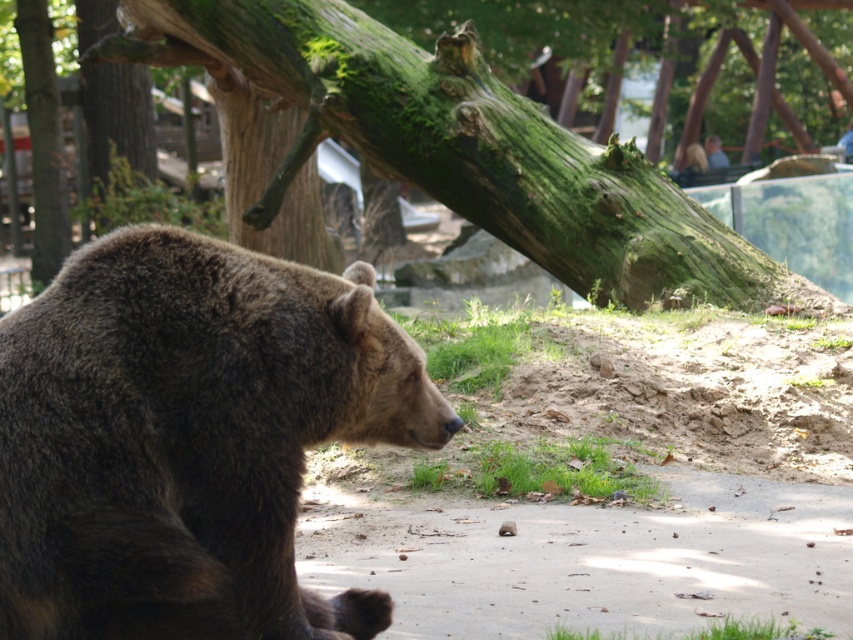
Which of these two, brown furry bear at center or green mossy log at upper center, stands shorter?

brown furry bear at center is shorter.

Is point (15, 548) farther from viewer compared to point (347, 122)?

No, (15, 548) is in front of (347, 122).

Who is more distant from viewer, (292, 364) or (451, 54)?

The point (451, 54) is more distant.

In order to click on brown furry bear at center in this screenshot , I will do `click(189, 438)`.